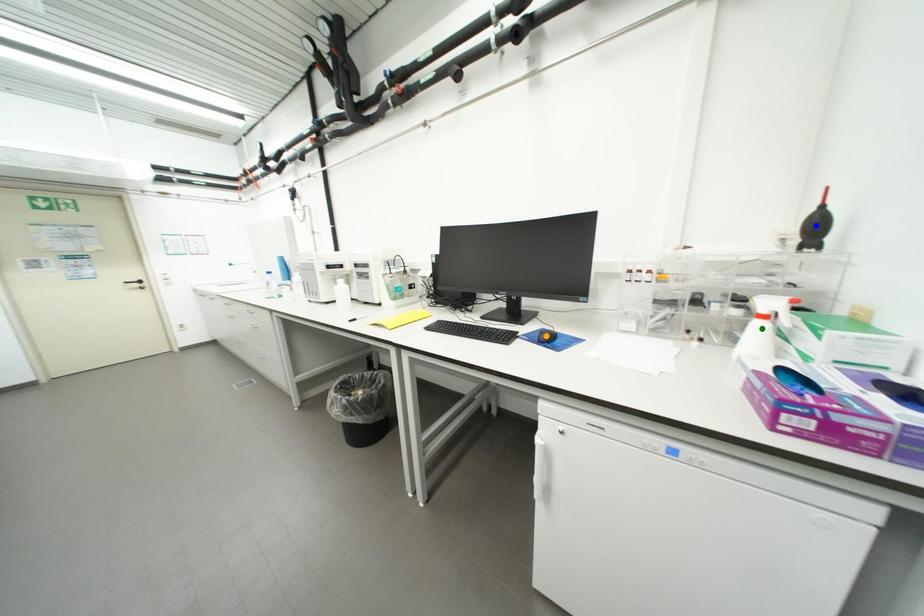
Order these from nearest to farthest:
orange point | blue point | green point

orange point < green point < blue point